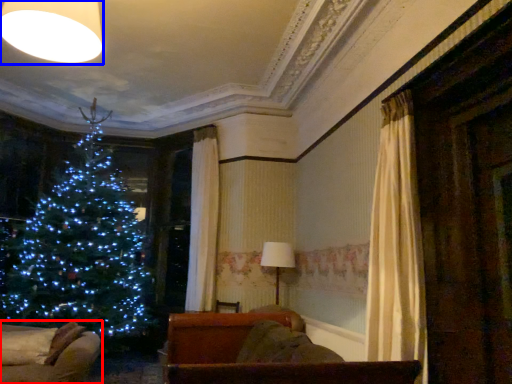
Question: Which object appears closest to the camera in this image, furniture (highlighted by a red box) or lighting (highlighted by a blue box)?

Choices:
 (A) furniture
 (B) lighting

Answer: (B)